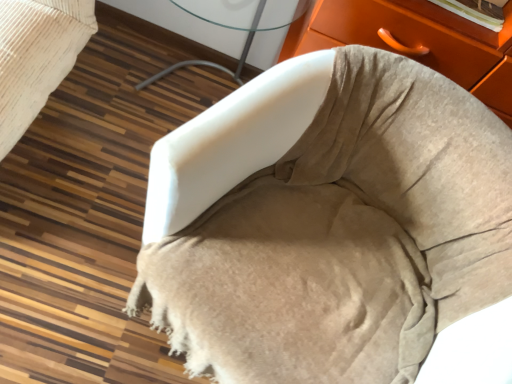
What do you see at coordinates (326, 222) in the screenshot?
I see `beige suede chair at center` at bounding box center [326, 222].

Locate an element on the screen. This screenshot has width=512, height=384. beige suede chair at center is located at coordinates (326, 222).

Where is `white glass table at center`? white glass table at center is located at coordinates (182, 30).

What is the approximate height of white glass table at center?

25.71 inches.

Describe the element at coordinates (182, 30) in the screenshot. I see `white glass table at center` at that location.

At what (x,y) coordinates should I click in order to perform the action: click on beige suede chair at center. Please return your answer as a coordinate pair (x, y). Looking at the image, I should click on (326, 222).

Considering the positions of objects white glass table at center and beige suede chair at center in the image provided, who is more to the right, white glass table at center or beige suede chair at center?

Positioned to the right is beige suede chair at center.

Does white glass table at center come behind beige suede chair at center?

Yes, white glass table at center is further from the camera.

Is point (189, 36) positioned behind point (246, 135)?

Yes, it is.

From the image's perspective, which one is positioned higher, white glass table at center or beige suede chair at center?

white glass table at center, from the image's perspective.

From a real-world perspective, is white glass table at center located higher than beige suede chair at center?

No.

Between white glass table at center and beige suede chair at center, which one has larger width?

With larger width is beige suede chair at center.

Considering the relative sizes of white glass table at center and beige suede chair at center in the image provided, is white glass table at center shorter than beige suede chair at center?

In fact, white glass table at center may be taller than beige suede chair at center.

Is white glass table at center bigger than beige suede chair at center?

No.

Is white glass table at center not inside beige suede chair at center?

Yes.

Is white glass table at center touching beige suede chair at center?

They are not placed beside each other.

Does white glass table at center turn towards beige suede chair at center?

No, white glass table at center is not turned towards beige suede chair at center.

How different are the orientations of white glass table at center and beige suede chair at center in degrees?

25.9 degrees.

At what (x,y) coordinates should I click in order to perform the action: click on table on the left of the beige suede chair at center. Please return your answer as a coordinate pair (x, y). Looking at the image, I should click on (182, 30).

In the image, is beige suede chair at center on the left side or the right side of white glass table at center?

Based on their positions, beige suede chair at center is located to the right of white glass table at center.

Considering their positions, is beige suede chair at center located in front of or behind white glass table at center?

Clearly, beige suede chair at center is in front of white glass table at center.

Which point is more forward, (x=337, y=155) or (x=213, y=30)?

The point (x=337, y=155) is closer to the camera.

From the image's perspective, which one is positioned lower, beige suede chair at center or white glass table at center?

From the image's view, beige suede chair at center is below.

From a real-world perspective, between beige suede chair at center and white glass table at center, who is vertically lower?

From a 3D spatial view, white glass table at center is below.

In terms of width, does beige suede chair at center look wider or thinner when compared to white glass table at center?

Clearly, beige suede chair at center has more width compared to white glass table at center.

Considering the sizes of objects beige suede chair at center and white glass table at center in the image provided, who is shorter, beige suede chair at center or white glass table at center?

With less height is beige suede chair at center.

In terms of size, does beige suede chair at center appear bigger or smaller than white glass table at center?

beige suede chair at center is bigger than white glass table at center.

Is white glass table at center completely or partially inside beige suede chair at center?

No, white glass table at center is not a part of beige suede chair at center.

Does beige suede chair at center touch white glass table at center?

beige suede chair at center is not next to white glass table at center, and they're not touching.

Looking at this image, is white glass table at center at the back of beige suede chair at center?

No, beige suede chair at center is not facing the opposite direction of white glass table at center.

How many degrees apart are the facing directions of beige suede chair at center and white glass table at center?

25.9 degrees separate the facing orientations of beige suede chair at center and white glass table at center.

At what (x,y) coordinates should I click in order to perform the action: click on table that is above the beige suede chair at center (from the image's perspective). Please return your answer as a coordinate pair (x, y). The image size is (512, 384). Looking at the image, I should click on (182, 30).

Find the location of `table on the left of beige suede chair at center`. table on the left of beige suede chair at center is located at coordinates (182, 30).

This screenshot has height=384, width=512. I want to click on furniture below the white glass table at center (from the image's perspective), so click(326, 222).